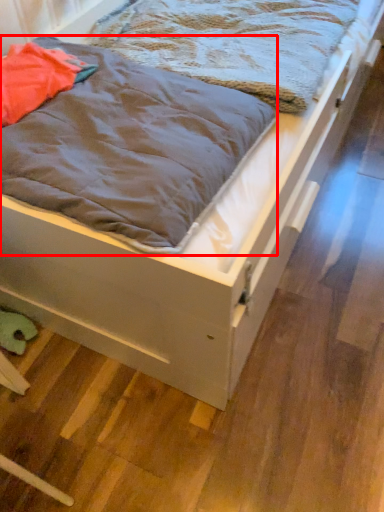
Question: Where is blanket (annotated by the red box) located in relation to blanket in the image?

Choices:
 (A) left
 (B) right

Answer: (A)